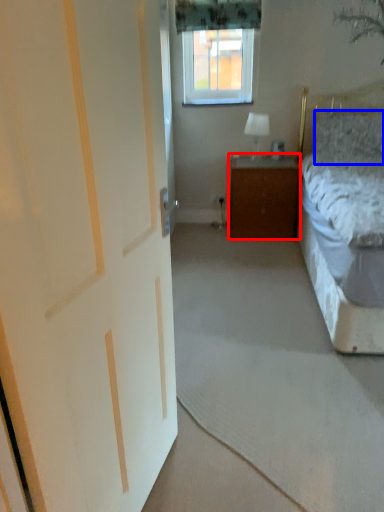
Question: Which object is further to the camera taking this photo, cabinetry (highlighted by a red box) or pillow (highlighted by a blue box)?

Choices:
 (A) cabinetry
 (B) pillow

Answer: (A)